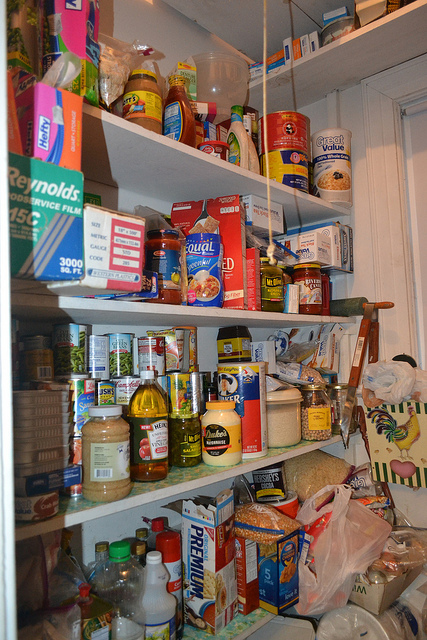
Find the location of a particular element. This screenshot has width=427, height=640. jar is located at coordinates tap(107, 454).